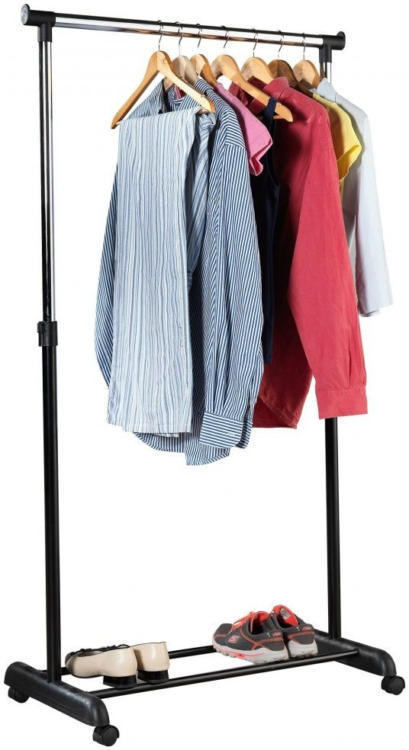
Where is `hangers`? This screenshot has width=409, height=750. hangers is located at coordinates (163, 68), (182, 68), (203, 66), (231, 66), (257, 68), (283, 69), (312, 69).